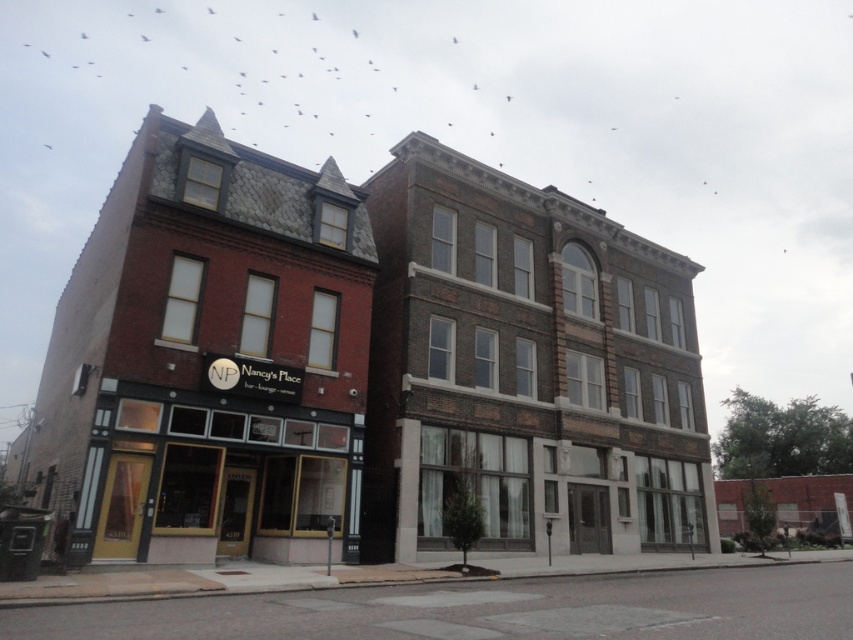
Question: Does brick building at center appear over matte glass storefront at center?

Choices:
 (A) no
 (B) yes

Answer: (B)

Question: Is brick building at center in front of matte glass storefront at center?

Choices:
 (A) yes
 (B) no

Answer: (A)

Question: Which point is farther to the camera?

Choices:
 (A) matte glass storefront at center
 (B) brick building at center

Answer: (A)

Question: Can you confirm if brick building at center is wider than matte glass storefront at center?

Choices:
 (A) no
 (B) yes

Answer: (B)

Question: Which of the following is the closest to the observer?

Choices:
 (A) (157, 342)
 (B) (273, 508)

Answer: (A)